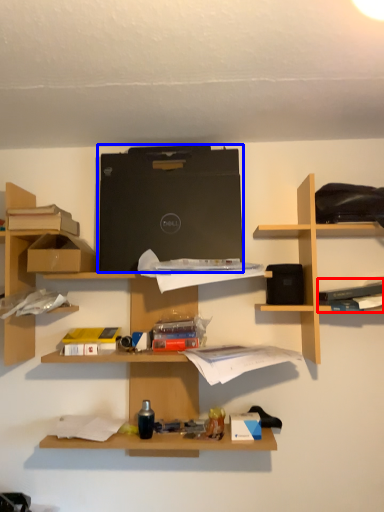
Question: Which of the following is the closest to the observer, book (highlighted by a red box) or computer (highlighted by a blue box)?

Choices:
 (A) book
 (B) computer

Answer: (A)